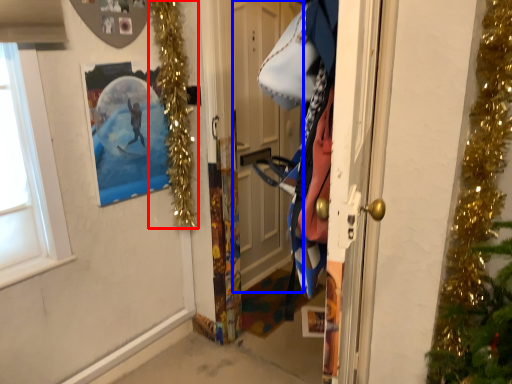
Question: Among these objects, which one is farthest to the camera, christmas light (highlighted by a red box) or door (highlighted by a blue box)?

Choices:
 (A) christmas light
 (B) door

Answer: (B)